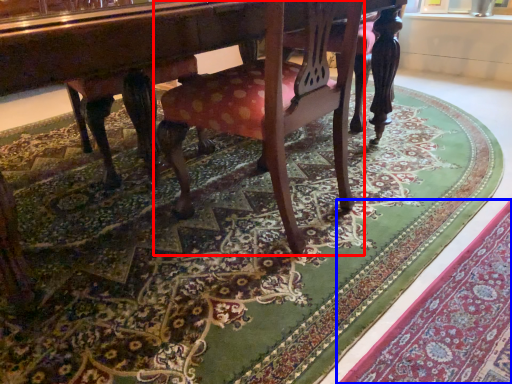
Question: Which of the following is the closest to the observer, chair (highlighted by a red box) or mat (highlighted by a blue box)?

Choices:
 (A) chair
 (B) mat

Answer: (B)